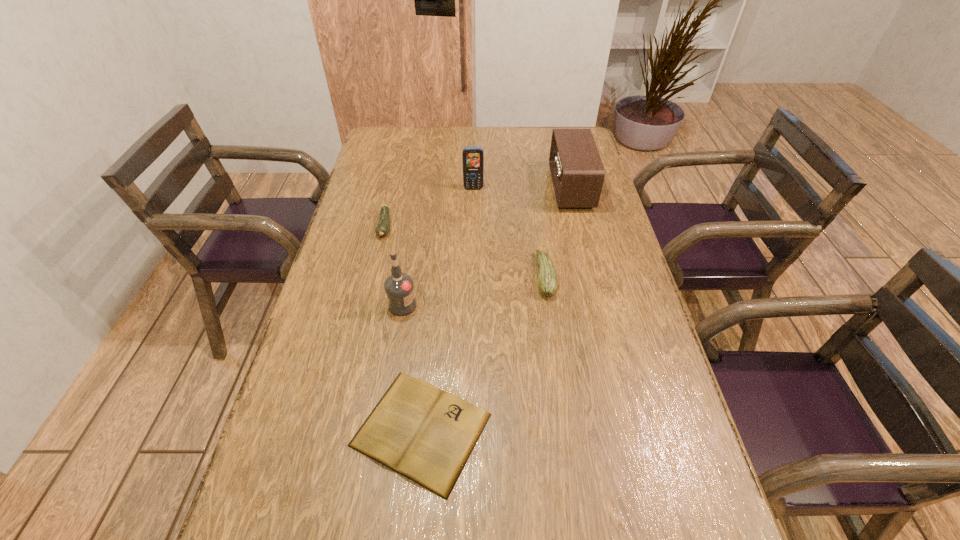
This screenshot has height=540, width=960. Identify the location of the tallest object. (399, 287).

You are a GUI agent. You are given a task and a screenshot of the screen. Output one action in this format:
    pyautogui.click(x=<x>, y=<y>)
    Task: Click on the cellular telephone
    
    Given the screenshot: What is the action you would take?
    pyautogui.click(x=473, y=157)

Identify the location of the rightmost object. The height and width of the screenshot is (540, 960). (577, 172).

Find the location of a particular element. This screenshot has height=540, width=960. the nearer zucchini is located at coordinates (547, 281).

Where is `the third shortest object`? This screenshot has width=960, height=540. the third shortest object is located at coordinates (547, 281).

This screenshot has width=960, height=540. In order to click on the shorter zucchini in this screenshot , I will do `click(382, 229)`.

Locate an element on the screen. This screenshot has height=540, width=960. the left zucchini is located at coordinates (382, 229).

Identify the location of the nearest object. Image resolution: width=960 pixels, height=540 pixels. (425, 434).

This screenshot has width=960, height=540. What are the coordinates of `the shortest object` in the screenshot? It's located at (425, 434).

At what (x,y) coordinates should I click in order to perform the action: click on vacant space situated 0.160m on the front label of the vodka. Please return your answer as a coordinate pair (x, y). The width and height of the screenshot is (960, 540). Looking at the image, I should click on (476, 305).